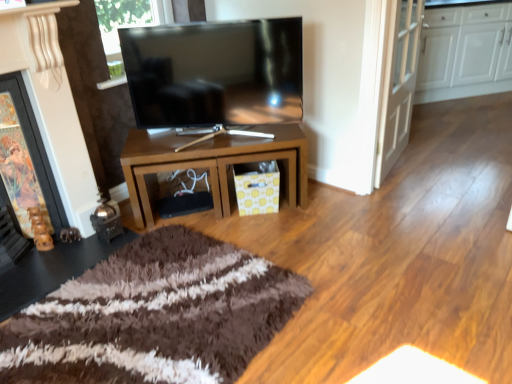
Question: From a real-world perspective, is matte black tv at center above or below brown glossy table at center?

Choices:
 (A) above
 (B) below

Answer: (A)

Question: Relative to brown glossy table at center, is matte black tv at center in front or behind?

Choices:
 (A) behind
 (B) front

Answer: (B)

Question: Which object is the closest to the wooden fireplace at left?

Choices:
 (A) white glossy door at upper right
 (B) white glossy cabinets at upper right
 (C) brown glossy table at center
 (D) matte black tv at center

Answer: (C)

Question: Based on their relative distances, which object is nearer to the wooden fireplace at left?

Choices:
 (A) brown glossy table at center
 (B) matte black tv at center
 (C) white glossy cabinets at upper right
 (D) white glossy door at upper right

Answer: (A)